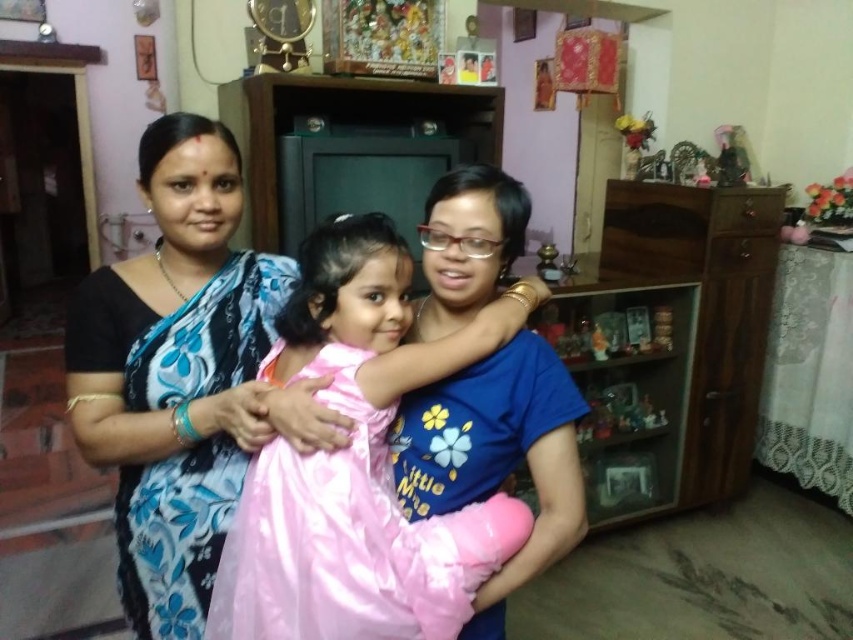
In the family photo, there are two women and a girl. The girl is wearing a pink satin dress at center, and one of the women is wearing a blue floral saree at center. If you need to hang both garments on a coat rack, which garment should you place higher up to ensure they don?t overlap?

The pink satin dress at center is shorter than the blue floral saree at center, so you should place the blue floral saree at center higher up on the coat rack to prevent overlapping.

You are a photographer trying to adjust the focus on your camera. You have two points to focus on in the image, point [227,531] and point [169,364]. Which point should you focus on first if you want to capture the closest subject?

Point [227,531] is closer to the viewer than point [169,364], so you should focus on point [227,531] first to capture the closest subject.